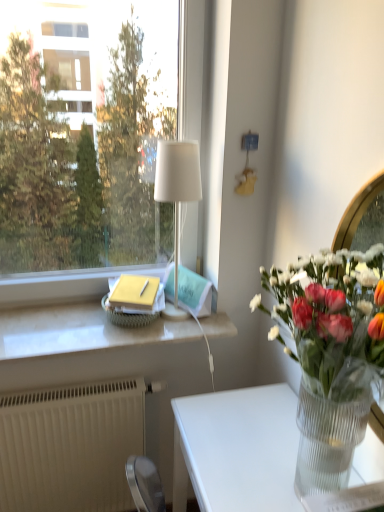
Where is `white fabric lampshade at upper center`? white fabric lampshade at upper center is located at coordinates (177, 195).

Locate an element on the screen. This screenshot has width=384, height=512. white textured radiator at lower left is located at coordinates (70, 446).

Image resolution: width=384 pixels, height=512 pixels. Find the location of `transparent glass vase at lower right`. transparent glass vase at lower right is located at coordinates (237, 450).

Between clear glass vase at right and white marble window sill at center, which one is positioned behind?

white marble window sill at center is behind.

Considering the positions of objects clear glass vase at right and white marble window sill at center in the image provided, who is more to the right, clear glass vase at right or white marble window sill at center?

From the viewer's perspective, clear glass vase at right appears more on the right side.

From the picture: Which is closer to the camera, (299, 330) or (109, 324)?

The point (299, 330) is more forward.

In order to click on window sill lying on the left of clear glass vase at right in this screenshot , I will do `click(79, 332)`.

From the picture: Is white fabric lampshade at upper center located outside white marble window sill at center?

Yes, white fabric lampshade at upper center is located beyond the bounds of white marble window sill at center.

Is white fabric lampshade at upper center taller than white marble window sill at center?

Indeed, white fabric lampshade at upper center has a greater height compared to white marble window sill at center.

From a real-world perspective, is white fabric lampshade at upper center positioned above or below white marble window sill at center?

From a real-world perspective, white fabric lampshade at upper center is physically above white marble window sill at center.

From a real-world perspective, which object rests below the other?

clear glass vase at right.

Considering the positions of objects clear glass vase at right and transparent glass window at upper left in the image provided, who is more to the left, clear glass vase at right or transparent glass window at upper left?

Positioned to the left is transparent glass window at upper left.

Consider the image. Can you confirm if clear glass vase at right is taller than transparent glass window at upper left?

No, clear glass vase at right is not taller than transparent glass window at upper left.

Can you confirm if clear glass vase at right is thinner than transparent glass window at upper left?

Incorrect, the width of clear glass vase at right is not less than that of transparent glass window at upper left.

Could you tell me if transparent glass vase at lower right is turned towards white marble window sill at center?

No, transparent glass vase at lower right is not aimed at white marble window sill at center.

Is transparent glass vase at lower right taller than white marble window sill at center?

Indeed, transparent glass vase at lower right has a greater height compared to white marble window sill at center.

Based on the photo, from a real-world perspective, between transparent glass vase at lower right and white marble window sill at center, who is vertically higher?

white marble window sill at center is physically above.

Is transparent glass vase at lower right further to the viewer compared to white marble window sill at center?

No, the depth of transparent glass vase at lower right is less than that of white marble window sill at center.

From a real-world perspective, is transparent glass window at upper left positioned above or below white textured radiator at lower left?

transparent glass window at upper left is situated higher than white textured radiator at lower left in the real world.

You are a GUI agent. You are given a task and a screenshot of the screen. Output one action in this format:
    pyautogui.click(x=<x>, y=<y>)
    Task: Click on the radiator below the transparent glass window at upper left (from the image's perspective)
    
    Given the screenshot: What is the action you would take?
    pyautogui.click(x=70, y=446)

Considering the relative positions of transparent glass window at upper left and white textured radiator at lower left in the image provided, is transparent glass window at upper left behind white textured radiator at lower left?

No, it is not.

Can you confirm if white textured radiator at lower left is taller than transparent glass window at upper left?

No, white textured radiator at lower left is not taller than transparent glass window at upper left.

From the image's perspective, which one is positioned lower, white textured radiator at lower left or transparent glass window at upper left?

white textured radiator at lower left, from the image's perspective.

How distant is white textured radiator at lower left from transparent glass window at upper left?

4.47 feet.

Where is `window above the white textured radiator at lower left (from a real-world perspective)`? window above the white textured radiator at lower left (from a real-world perspective) is located at coordinates (87, 146).

Which is correct: transparent glass vase at lower right is inside white fabric lampshade at upper center, or outside of it?

transparent glass vase at lower right is located beyond the bounds of white fabric lampshade at upper center.

From the image's perspective, is transparent glass vase at lower right above or below white fabric lampshade at upper center?

transparent glass vase at lower right is below white fabric lampshade at upper center.

Which is more to the right, transparent glass vase at lower right or white fabric lampshade at upper center?

transparent glass vase at lower right.

Find the location of a particular element. The image size is (384, 512). houseplant above the white marble window sill at center (from a real-world perspective) is located at coordinates (331, 355).

What are the coordinates of `lamp above the white marble window sill at center (from the image's perspective)` in the screenshot? It's located at (177, 195).

Looking at the image, which one is located further to white marble window sill at center, white fabric lampshade at upper center or transparent glass window at upper left?

transparent glass window at upper left is further to white marble window sill at center.

Based on their spatial positions, is white textured radiator at lower left or transparent glass vase at lower right closer to white marble window sill at center?

white textured radiator at lower left is positioned closer to the anchor white marble window sill at center.

From the image, which object appears to be nearer to clear glass vase at right, transparent glass window at upper left or white fabric lampshade at upper center?

Among the two, white fabric lampshade at upper center is located nearer to clear glass vase at right.

Estimate the real-world distances between objects in this image. Which object is further from white fabric lampshade at upper center, transparent glass vase at lower right or white marble window sill at center?

Based on the image, transparent glass vase at lower right appears to be further to white fabric lampshade at upper center.

Based on their spatial positions, is white marble window sill at center or clear glass vase at right further from transparent glass window at upper left?

The object further to transparent glass window at upper left is clear glass vase at right.

Looking at this image, which object lies nearer to the anchor point transparent glass vase at lower right, transparent glass window at upper left or white marble window sill at center?

Based on the image, white marble window sill at center appears to be nearer to transparent glass vase at lower right.

Looking at this image, from the image, which object appears to be farther from white marble window sill at center, clear glass vase at right or white fabric lampshade at upper center?

clear glass vase at right lies further to white marble window sill at center than the other object.

When comparing their distances from transparent glass window at upper left, does transparent glass vase at lower right or clear glass vase at right seem further?

Among the two, transparent glass vase at lower right is located further to transparent glass window at upper left.

Locate an element on the screen. desk located between white textured radiator at lower left and clear glass vase at right in the left-right direction is located at coordinates (237, 450).

This screenshot has height=512, width=384. In order to click on lamp positioned between clear glass vase at right and white textured radiator at lower left from near to far in this screenshot , I will do `click(177, 195)`.

Identify the location of window sill positioned between clear glass vase at right and white textured radiator at lower left from near to far. (79, 332).

Locate an element on the screen. The image size is (384, 512). desk between clear glass vase at right and white marble window sill at center in the front-back direction is located at coordinates (237, 450).